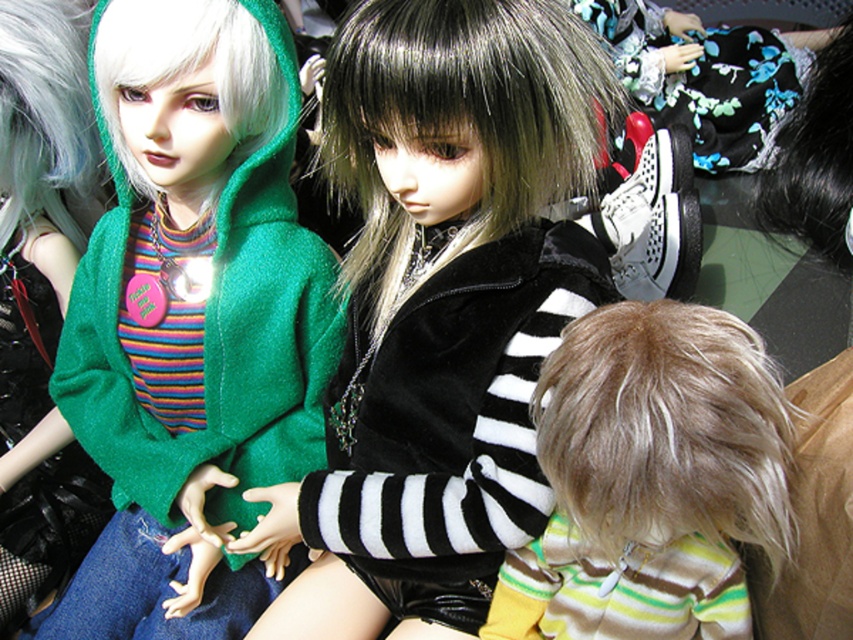
Who is shorter, velvet black jacket at center or green matte hoodie at left?

Standing shorter between the two is velvet black jacket at center.

Between point (409, 381) and point (36, 179), which one is positioned behind?

The point (36, 179) is more distant.

I want to click on velvet black jacket at center, so click(x=442, y=307).

Consider the image. Can you confirm if black silky wig at center is positioned to the right of green matte hoodie at left?

Correct, you'll find black silky wig at center to the right of green matte hoodie at left.

Can you confirm if black silky wig at center is taller than green matte hoodie at left?

In fact, black silky wig at center may be shorter than green matte hoodie at left.

The height and width of the screenshot is (640, 853). What are the coordinates of `black silky wig at center` in the screenshot? It's located at (460, 116).

Find the location of a particular element. Image resolution: width=853 pixels, height=640 pixels. white matte wig at upper left is located at coordinates (189, 68).

Does white matte wig at upper left have a greater width compared to black silky hair at upper right?

Yes.

The width and height of the screenshot is (853, 640). What are the coordinates of `white matte wig at upper left` in the screenshot? It's located at (189, 68).